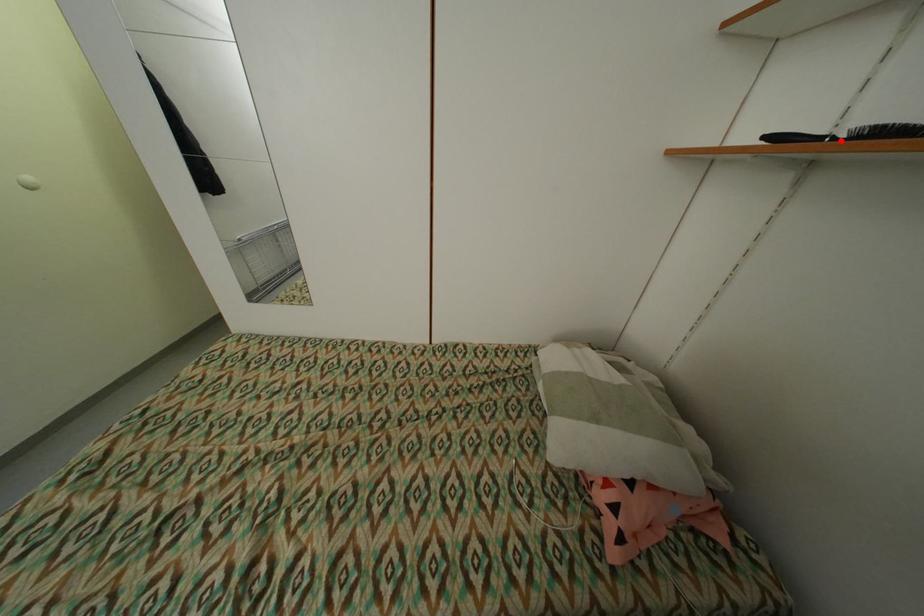
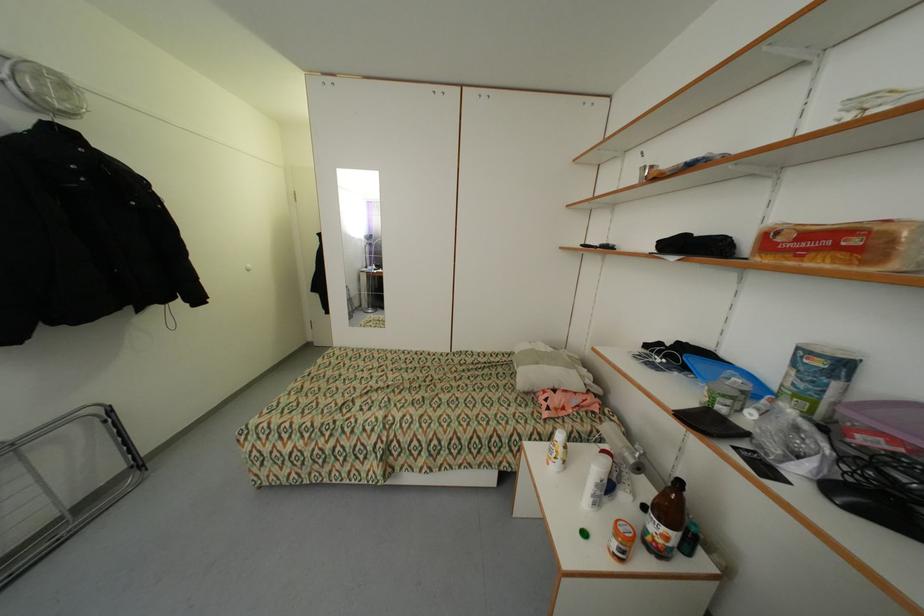
Locate, in the second image, the point that corresponds to the highlighted location in the first image.

(602, 248)